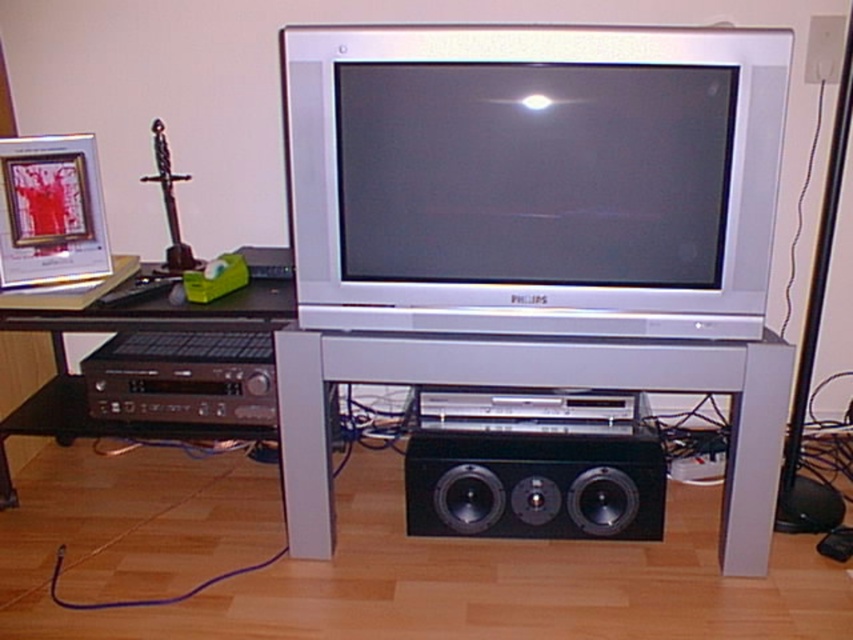
Who is higher up, metallic silver table at center or black plastic computer desk at lower left?

black plastic computer desk at lower left

Between point (299, 465) and point (125, 432), which one is positioned behind?

The point (125, 432) is more distant.

You are a GUI agent. You are given a task and a screenshot of the screen. Output one action in this format:
    pyautogui.click(x=<x>, y=<y>)
    Task: Click on the metallic silver table at center
    The height and width of the screenshot is (640, 853).
    Given the screenshot: What is the action you would take?
    tap(538, 387)

Is metallic silver table at center below black matte speaker at lower center?

Actually, metallic silver table at center is above black matte speaker at lower center.

The width and height of the screenshot is (853, 640). What do you see at coordinates (538, 387) in the screenshot? I see `metallic silver table at center` at bounding box center [538, 387].

This screenshot has height=640, width=853. In order to click on metallic silver table at center in this screenshot , I will do `click(538, 387)`.

Is black plastic stereo at lower left to the left of black plastic computer desk at lower left from the viewer's perspective?

Yes, black plastic stereo at lower left is to the left of black plastic computer desk at lower left.

Who is higher up, black plastic stereo at lower left or black plastic computer desk at lower left?

black plastic computer desk at lower left is above.

Is point (228, 342) in front of point (241, 321)?

No, it is behind (241, 321).

Identify the location of black plastic stereo at lower left. pos(183,378).